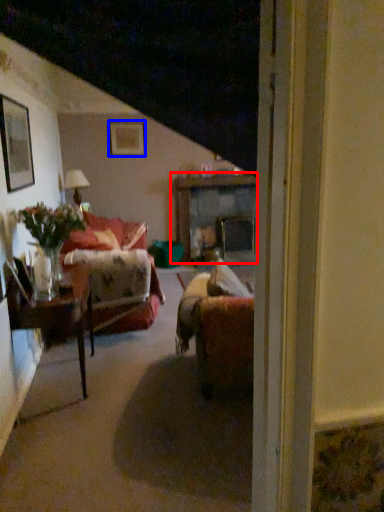
Question: Which object is further to the camera taking this photo, table (highlighted by a red box) or picture frame (highlighted by a blue box)?

Choices:
 (A) table
 (B) picture frame

Answer: (A)